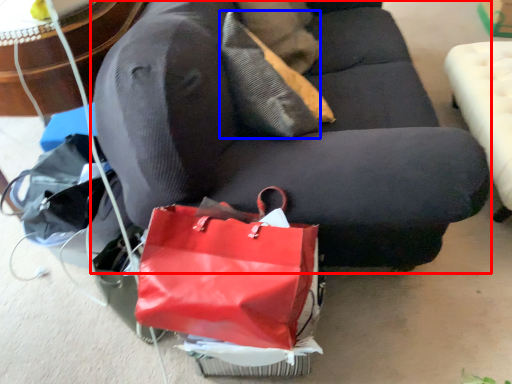
Question: Which of the following is the closest to the observer, studio couch (highlighted by a red box) or pillow (highlighted by a blue box)?

Choices:
 (A) studio couch
 (B) pillow

Answer: (A)